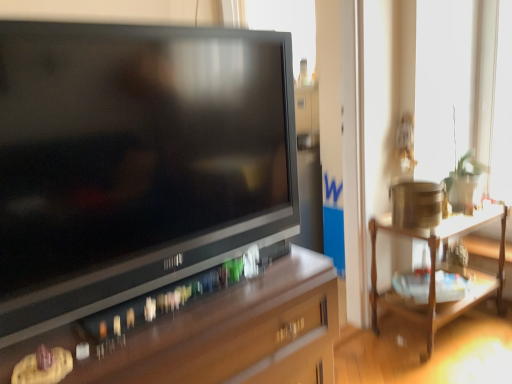
Question: Considering the relative sizes of wooden table at right and matte black television at center in the image provided, is wooden table at right smaller than matte black television at center?

Choices:
 (A) yes
 (B) no

Answer: (B)

Question: From the image's perspective, is wooden table at right on top of matte black television at center?

Choices:
 (A) yes
 (B) no

Answer: (B)

Question: Considering the relative sizes of wooden table at right and matte black television at center in the image provided, is wooden table at right bigger than matte black television at center?

Choices:
 (A) no
 (B) yes

Answer: (B)

Question: Could you tell me if wooden table at right is turned towards matte black television at center?

Choices:
 (A) no
 (B) yes

Answer: (A)

Question: Is wooden table at right beside matte black television at center?

Choices:
 (A) yes
 (B) no

Answer: (B)

Question: In terms of width, does matte black television at center look wider or thinner when compared to wooden table at right?

Choices:
 (A) wide
 (B) thin

Answer: (B)

Question: Considering the positions of matte black television at center and wooden table at right in the image, is matte black television at center bigger or smaller than wooden table at right?

Choices:
 (A) small
 (B) big

Answer: (A)

Question: Is matte black television at center to the left or to the right of wooden table at right in the image?

Choices:
 (A) left
 (B) right

Answer: (A)

Question: From a real-world perspective, is matte black television at center physically located above or below wooden table at right?

Choices:
 (A) above
 (B) below

Answer: (A)

Question: From their relative heights in the image, would you say brown wood desk at lower left is taller or shorter than matte black television at center?

Choices:
 (A) tall
 (B) short

Answer: (B)

Question: Considering the relative positions of brown wood desk at lower left and matte black television at center in the image provided, is brown wood desk at lower left to the left or to the right of matte black television at center?

Choices:
 (A) right
 (B) left

Answer: (B)

Question: From the image's perspective, is brown wood desk at lower left located above or below matte black television at center?

Choices:
 (A) below
 (B) above

Answer: (A)

Question: From a real-world perspective, relative to matte black television at center, is brown wood desk at lower left vertically above or below?

Choices:
 (A) below
 (B) above

Answer: (A)

Question: Looking at the image, does wooden table at right seem bigger or smaller compared to matte black television at center?

Choices:
 (A) small
 (B) big

Answer: (B)

Question: Would you say wooden table at right is inside or outside matte black television at center?

Choices:
 (A) inside
 (B) outside

Answer: (B)